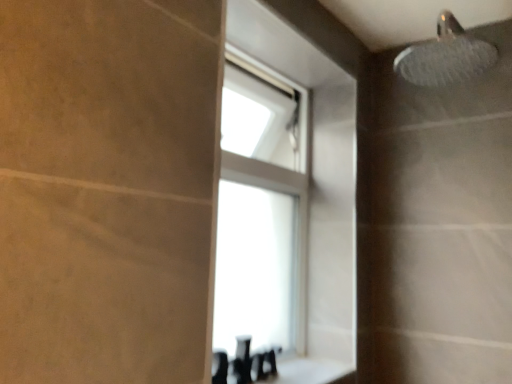
What do you see at coordinates (309, 371) in the screenshot?
I see `white glossy counter top at lower center` at bounding box center [309, 371].

Locate an element on the screen. The width and height of the screenshot is (512, 384). white glossy counter top at lower center is located at coordinates (309, 371).

The image size is (512, 384). What do you see at coordinates (310, 157) in the screenshot?
I see `transparent glass window at upper center` at bounding box center [310, 157].

At what (x,y) coordinates should I click in order to perform the action: click on transparent glass window at upper center. Please return your answer as a coordinate pair (x, y). Looking at the image, I should click on (310, 157).

In order to face transparent glass window at upper center, should I rotate leftwards or rightwards?

Turn right approximately 0.073 degrees to face it.

Where is `white glossy counter top at lower center`? white glossy counter top at lower center is located at coordinates (309, 371).

Considering the relative positions of transparent glass window at upper center and white glossy counter top at lower center in the image provided, is transparent glass window at upper center to the left or to the right of white glossy counter top at lower center?

transparent glass window at upper center is to the left of white glossy counter top at lower center.

Is the position of transparent glass window at upper center more distant than that of white glossy counter top at lower center?

Yes, transparent glass window at upper center is behind white glossy counter top at lower center.

Which is further, (236, 35) or (328, 362)?

Point (328, 362)

Looking at this image, from the image's perspective, relative to white glossy counter top at lower center, is transparent glass window at upper center above or below?

From the image's perspective, transparent glass window at upper center appears above white glossy counter top at lower center.

From a real-world perspective, is transparent glass window at upper center physically below white glossy counter top at lower center?

No, from a real-world perspective, transparent glass window at upper center is not beneath white glossy counter top at lower center.

Between transparent glass window at upper center and white glossy counter top at lower center, which one has smaller width?

transparent glass window at upper center is thinner.

In terms of height, does transparent glass window at upper center look taller or shorter compared to white glossy counter top at lower center?

Clearly, transparent glass window at upper center is taller compared to white glossy counter top at lower center.

Based on their sizes in the image, would you say transparent glass window at upper center is bigger or smaller than white glossy counter top at lower center?

Considering their sizes, transparent glass window at upper center takes up more space than white glossy counter top at lower center.

Would you say white glossy counter top at lower center is part of transparent glass window at upper center's contents?

No, white glossy counter top at lower center is not a part of transparent glass window at upper center.

Based on the photo, are transparent glass window at upper center and white glossy counter top at lower center beside each other?

They are not placed beside each other.

Is transparent glass window at upper center oriented away from white glossy counter top at lower center?

transparent glass window at upper center does not have its back to white glossy counter top at lower center.

What's the angular difference between transparent glass window at upper center and white glossy counter top at lower center's facing directions?

There is a 0.673-degree angle between the facing directions of transparent glass window at upper center and white glossy counter top at lower center.

Identify the location of counter top on the right of the transparent glass window at upper center. (309, 371).

Is white glossy counter top at lower center to the right of transparent glass window at upper center from the viewer's perspective?

Yes, white glossy counter top at lower center is to the right of transparent glass window at upper center.

Considering the positions of objects white glossy counter top at lower center and transparent glass window at upper center in the image provided, who is in front, white glossy counter top at lower center or transparent glass window at upper center?

white glossy counter top at lower center is more forward.

Is point (305, 358) closer to viewer compared to point (298, 309)?

Yes, point (305, 358) is in front of point (298, 309).

From the image's perspective, is white glossy counter top at lower center on transparent glass window at upper center?

No, from the image's perspective, white glossy counter top at lower center is not above transparent glass window at upper center.

From a real-world perspective, is white glossy counter top at lower center below transparent glass window at upper center?

Yes, from a real-world perspective, white glossy counter top at lower center is below transparent glass window at upper center.

Is white glossy counter top at lower center wider or thinner than transparent glass window at upper center?

In the image, white glossy counter top at lower center appears to be wider than transparent glass window at upper center.

Between white glossy counter top at lower center and transparent glass window at upper center, which one has more height?

transparent glass window at upper center.

Which of these two, white glossy counter top at lower center or transparent glass window at upper center, is smaller?

With smaller size is white glossy counter top at lower center.

In the scene shown: Is white glossy counter top at lower center not within transparent glass window at upper center?

white glossy counter top at lower center lies outside transparent glass window at upper center's area.

Is the surface of white glossy counter top at lower center in direct contact with transparent glass window at upper center?

No, white glossy counter top at lower center is not next to transparent glass window at upper center.

Could you tell me if white glossy counter top at lower center is facing transparent glass window at upper center?

No, white glossy counter top at lower center is not aimed at transparent glass window at upper center.

What's the angular difference between white glossy counter top at lower center and transparent glass window at upper center's facing directions?

The angular difference between white glossy counter top at lower center and transparent glass window at upper center is 0.673 degrees.

How far apart are white glossy counter top at lower center and transparent glass window at upper center?

The distance of white glossy counter top at lower center from transparent glass window at upper center is 19.59 inches.

Where is `window located behind the white glossy counter top at lower center`? window located behind the white glossy counter top at lower center is located at coordinates (310, 157).

You are a GUI agent. You are given a task and a screenshot of the screen. Output one action in this format:
    pyautogui.click(x=<x>, y=<y>)
    Task: Click on the counter top below the transparent glass window at upper center (from a real-world perspective)
    The height and width of the screenshot is (384, 512).
    Given the screenshot: What is the action you would take?
    pyautogui.click(x=309, y=371)

The height and width of the screenshot is (384, 512). Identify the location of counter top located below the transparent glass window at upper center (from the image's perspective). (309, 371).